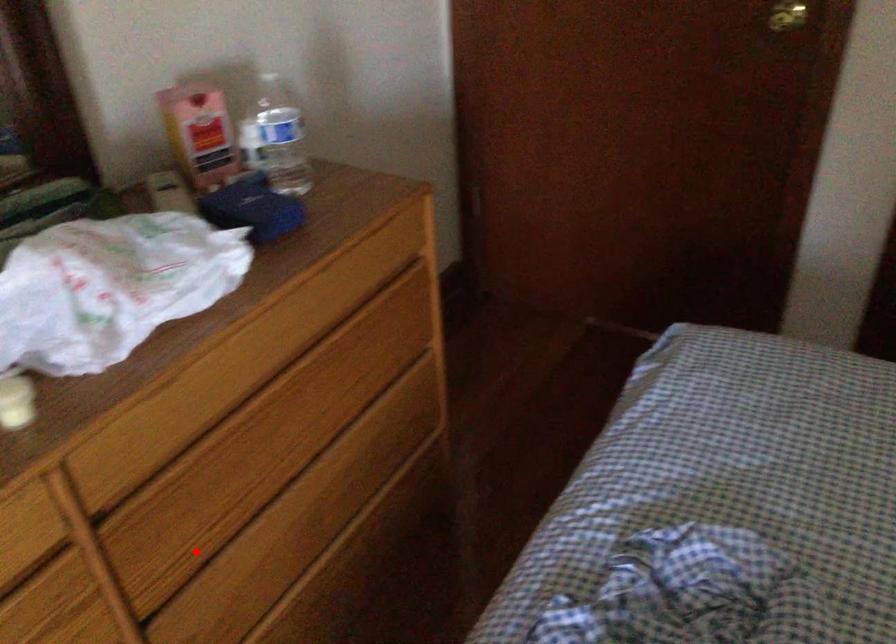
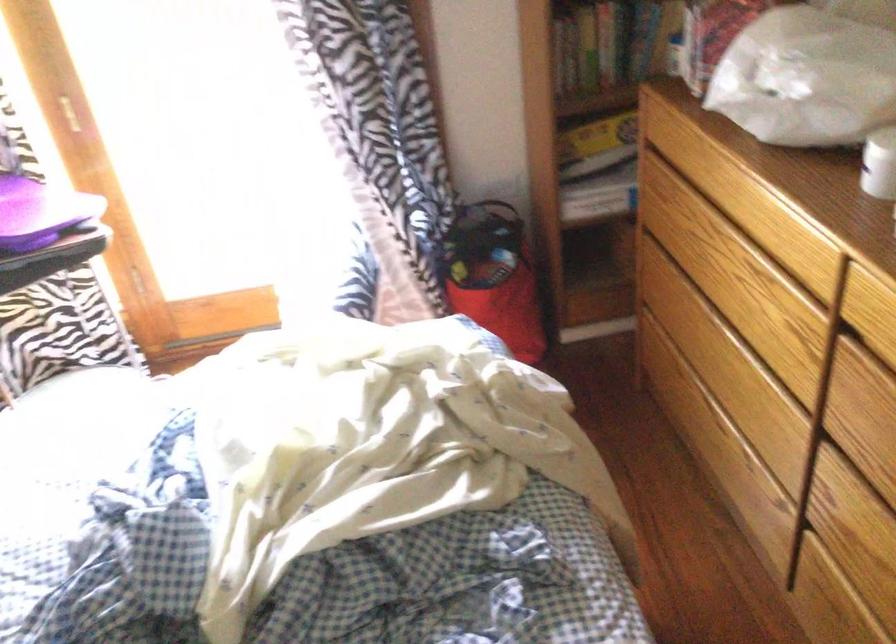
Where in the second image is the point corresponding to the highlighted location from the first image?

(868, 460)